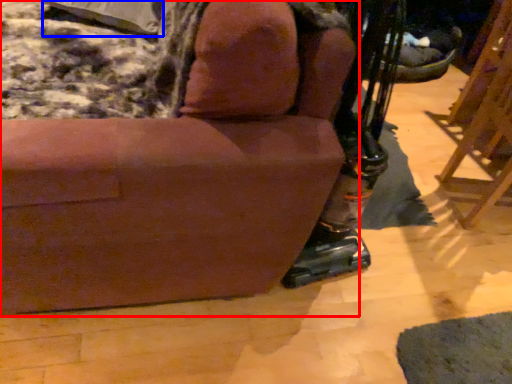
Question: Which of the following is the farthest to the observer, chair (highlighted by a red box) or pillow (highlighted by a blue box)?

Choices:
 (A) chair
 (B) pillow

Answer: (B)